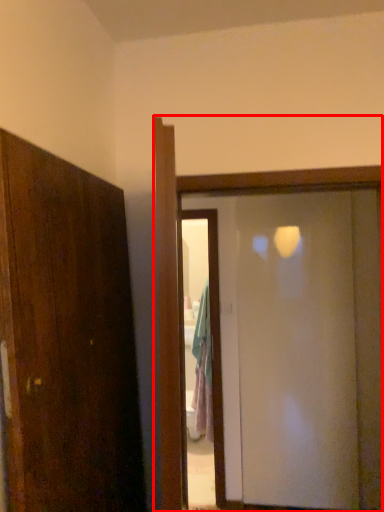
Question: From the image's perspective, what is the correct spatial positioning of door (annotated by the red box) in reference to screen door?

Choices:
 (A) above
 (B) below

Answer: (A)